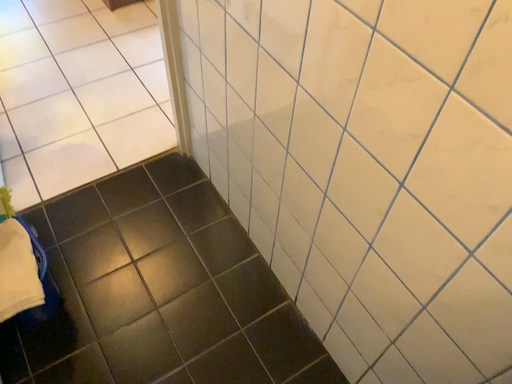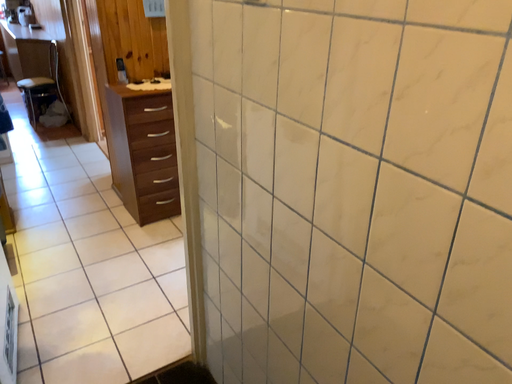
Question: How did the camera likely rotate when shooting the video?

Choices:
 (A) rotated downward
 (B) rotated upward

Answer: (B)